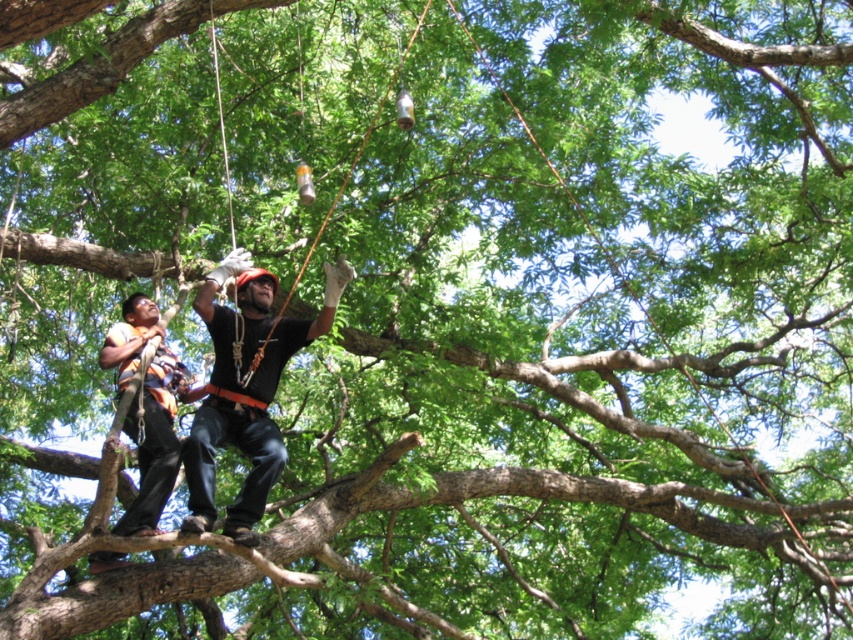
You are assessing the safety gear of two workers in the image. The black matte shirt at center and orange safety vest at center are both visible. Which item of clothing is bigger in size?

The black matte shirt at center has a larger size compared to the orange safety vest at center.

You are a safety inspector observing the workers in the tree. You notice both the black matte shirt at center and orange safety vest at center. Which clothing item is covering the other?

The black matte shirt at center is positioned over orange safety vest at center, so it is covering the orange safety vest at center.